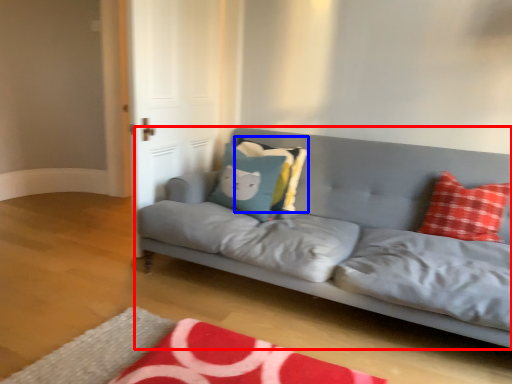
Question: Which of the following is the closest to the observer, studio couch (highlighted by a red box) or pillow (highlighted by a blue box)?

Choices:
 (A) studio couch
 (B) pillow

Answer: (A)